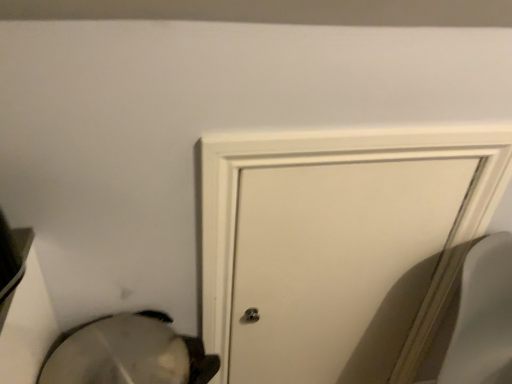
Where is `white matte door at center`? Image resolution: width=512 pixels, height=384 pixels. white matte door at center is located at coordinates (339, 246).

What do you see at coordinates (339, 246) in the screenshot?
I see `white matte door at center` at bounding box center [339, 246].

What is the approximate width of white matte door at center?

white matte door at center is 2.48 inches in width.

Locate an element on the screen. The image size is (512, 384). white matte door at center is located at coordinates (339, 246).